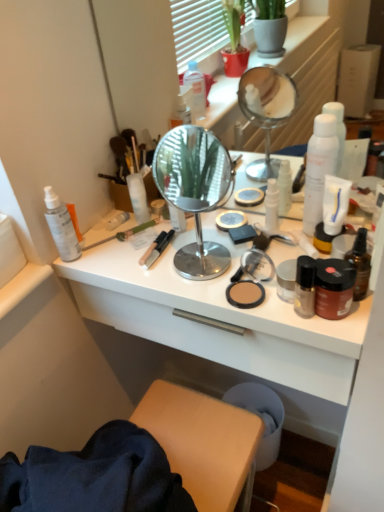
Where is `empty space that is to the right of clear plastic tube at center, marked as the sixth toiletry in a right-to-left arrangement`? Image resolution: width=384 pixels, height=512 pixels. empty space that is to the right of clear plastic tube at center, marked as the sixth toiletry in a right-to-left arrangement is located at coordinates (188, 226).